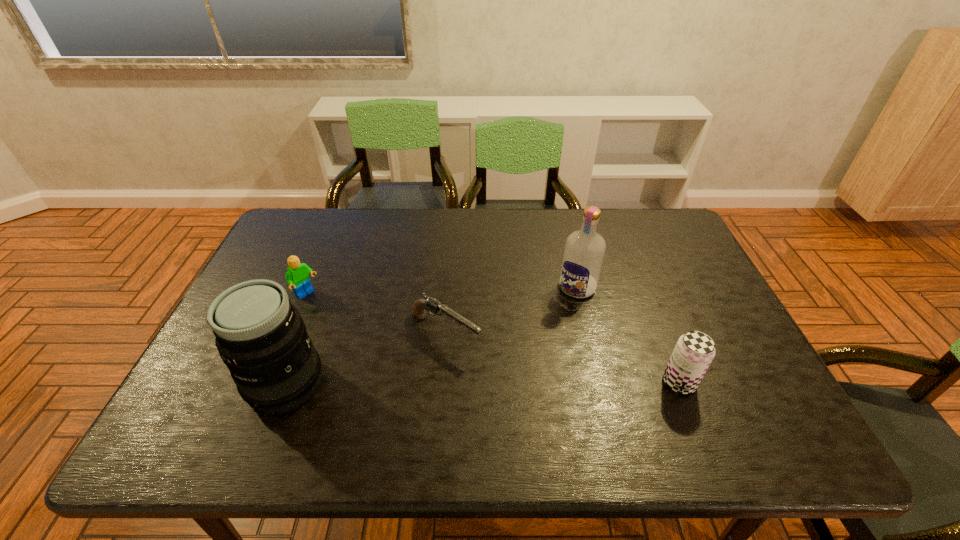
This screenshot has height=540, width=960. I want to click on vacant point located between the rightmost object and the second object from right to left, so click(628, 335).

You are a GUI agent. You are given a task and a screenshot of the screen. Output one action in this format:
    pyautogui.click(x=<x>, y=<y>)
    Task: Click on the vacant area that lies between the Lego and the beer can
    The height and width of the screenshot is (540, 960).
    Given the screenshot: What is the action you would take?
    pyautogui.click(x=493, y=339)

You are a GUI agent. You are given a task and a screenshot of the screen. Output one action in this format:
    pyautogui.click(x=<x>, y=<y>)
    Task: Click on the unoccupied area between the vodka and the telephoto lens
    
    Given the screenshot: What is the action you would take?
    pyautogui.click(x=431, y=336)

I want to click on free point between the beer can and the gun, so click(x=563, y=357).

At what (x,y) coordinates should I click in order to perform the action: click on unoccupied position between the Lego and the vodka. Please return your answer as a coordinate pair (x, y). This screenshot has width=960, height=540. Looking at the image, I should click on (442, 291).

Identify the location of object that stands as the third closest to the second object from right to left. This screenshot has height=540, width=960. (261, 337).

Point out which object is positioned as the third nearest to the rightmost object. Please provide its 2D coordinates. Your answer should be formatted as a tuple, i.e. [(x, y)], where the tuple contains the x and y coordinates of a point satisfying the conditions above.

[(261, 337)]